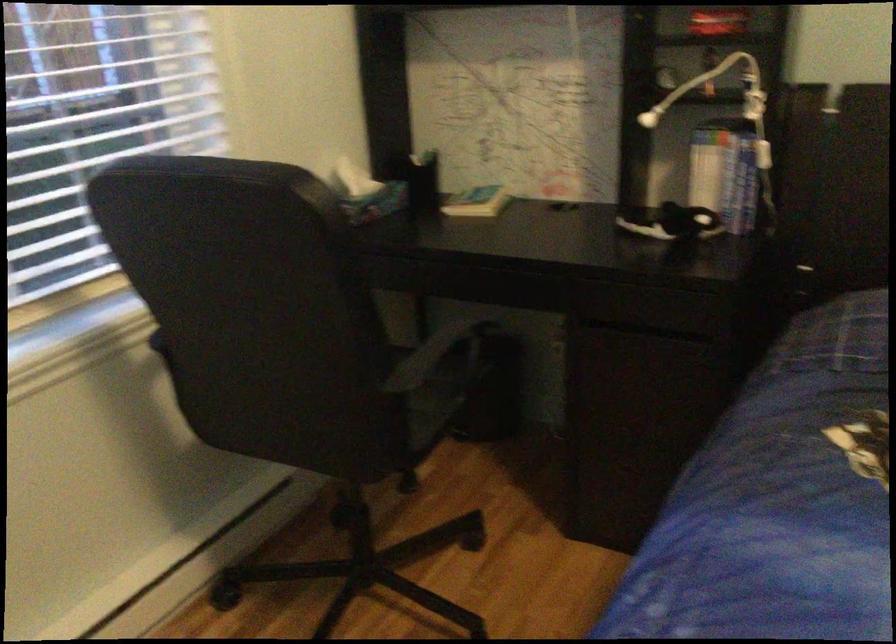
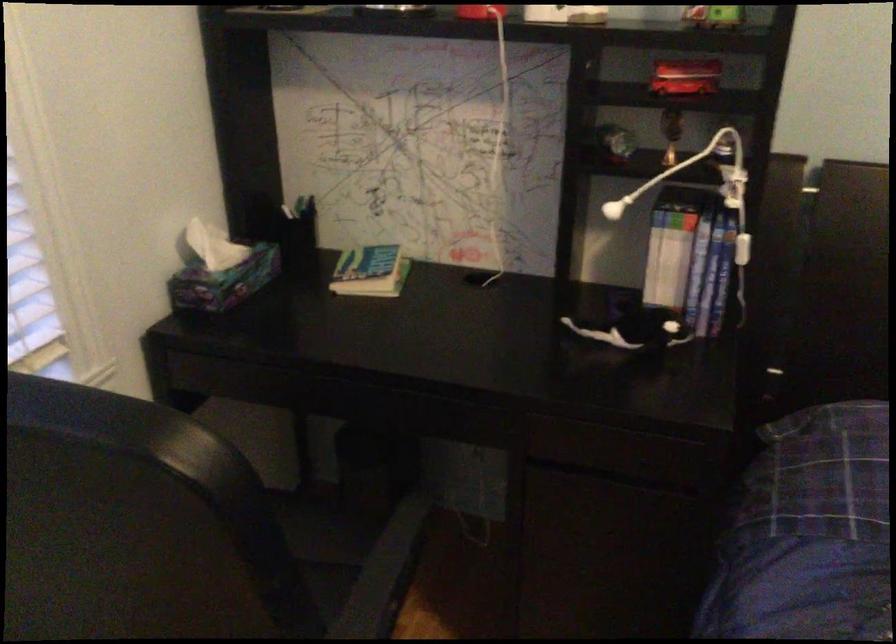
Question: The images are taken continuously from a first-person perspective. In which direction are you moving?

Choices:
 (A) Left
 (B) Right
 (C) Forward
 (D) Backward

Answer: (C)